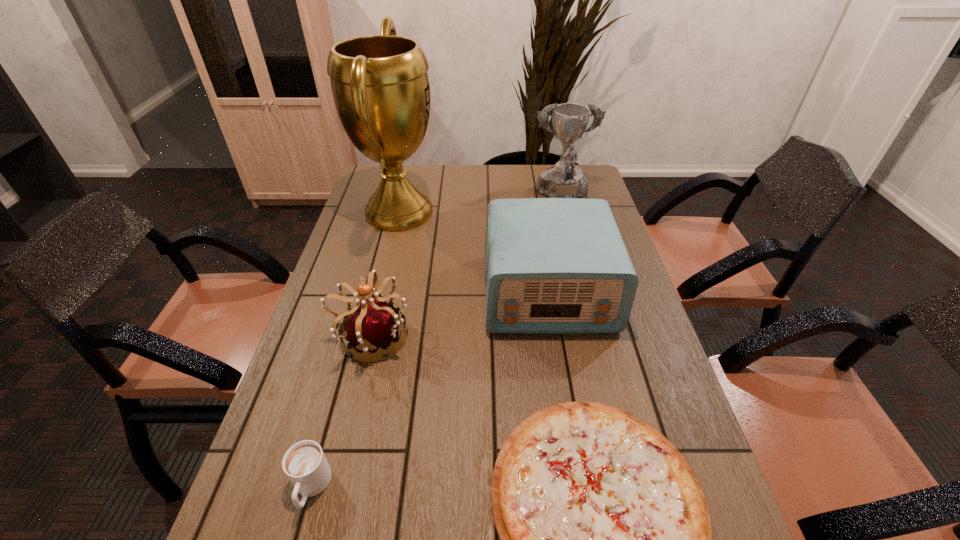
Locate an element on the screen. award that is positioned at the far edge is located at coordinates (563, 180).

At what (x,y) coordinates should I click in order to perform the action: click on trophy cup that is at the left edge. Please return your answer as a coordinate pair (x, y). The image size is (960, 540). Looking at the image, I should click on (380, 85).

This screenshot has width=960, height=540. I want to click on tiara that is at the left edge, so click(x=373, y=323).

The image size is (960, 540). I want to click on cappuccino situated at the left edge, so click(x=304, y=463).

I want to click on award present at the right edge, so click(563, 180).

You are a GUI agent. You are given a task and a screenshot of the screen. Output one action in this format:
    pyautogui.click(x=<x>, y=<y>)
    Task: Click on the radio receiver located at the right edge
    The image size is (960, 540).
    Given the screenshot: What is the action you would take?
    point(552,265)

You are a GUI agent. You are given a task and a screenshot of the screen. Output one action in this format:
    pyautogui.click(x=<x>, y=<y>)
    Task: Click on the object located at the far left corner
    
    Given the screenshot: What is the action you would take?
    pyautogui.click(x=380, y=85)

This screenshot has width=960, height=540. I want to click on object situated at the far right corner, so click(x=563, y=180).

Locate an element on the screen. The height and width of the screenshot is (540, 960). free space at the far edge of the desktop is located at coordinates (507, 172).

Locate an element on the screen. vacant region at the left edge of the desktop is located at coordinates (348, 278).